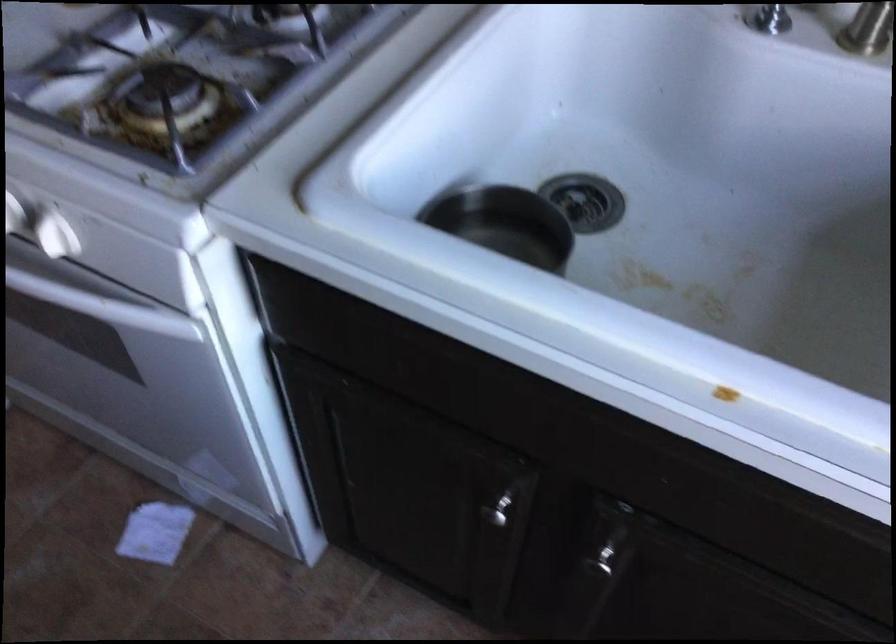
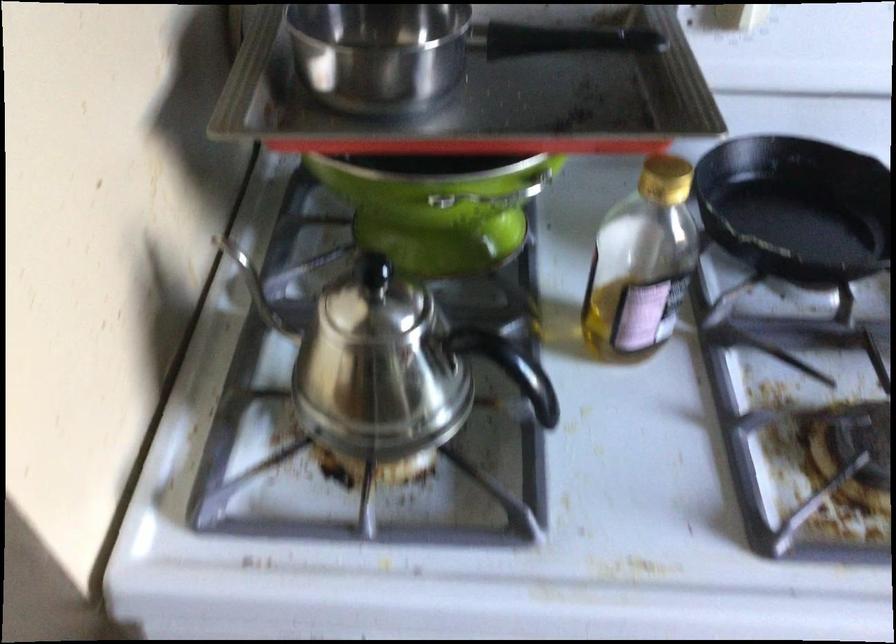
In a continuous first-person perspective shot, in which direction is the camera moving?

The cameraman walked toward left, forward.